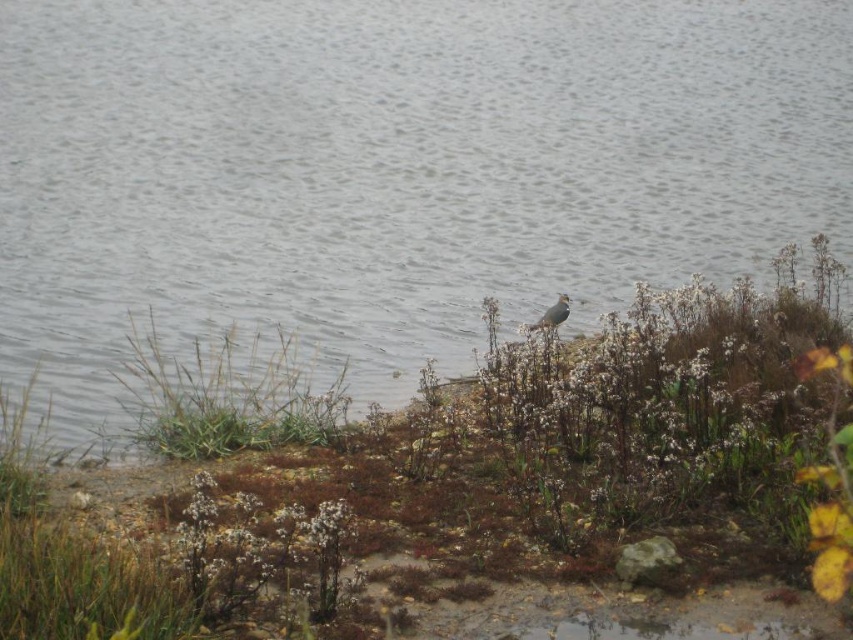
You are a small robot with a body length of 1 meter. You are standing near the brown grass at center and want to reach the gray matte bird at center. Can you reach the bird without moving past your current position?

The distance between the brown grass at center and the gray matte bird at center is 1.47 meters. Since the robot is 1 meter long, it cannot reach the bird without moving forward as the distance is greater than its body length.

You are standing at the lakeside and want to walk to the bird. You notice two points marked on the ground. The first point is at coordinate point (334, 410) and the second is at point (550, 314). Which point is closer to you as you stand at the starting position?

Point (334, 410) is closer to the viewer than point (550, 314), so you should head towards point (334, 410) first.

You are standing at the lakeside and see a bird at point (x=393, y=280). If you want to approach it without getting your shoes wet, what is the maximum distance you can walk towards it before reaching the water?

The point (x=393, y=280) is 11.64 meters away from you. Since the bird is at that point, the maximum distance you can walk towards it without getting your shoes wet would be up to the water edge. However, without knowing the exact distance from your current position to the water edge, we cannot determine the precise maximum distance. The information provided only states the distance from you to the bird, not the distance from you to the water.